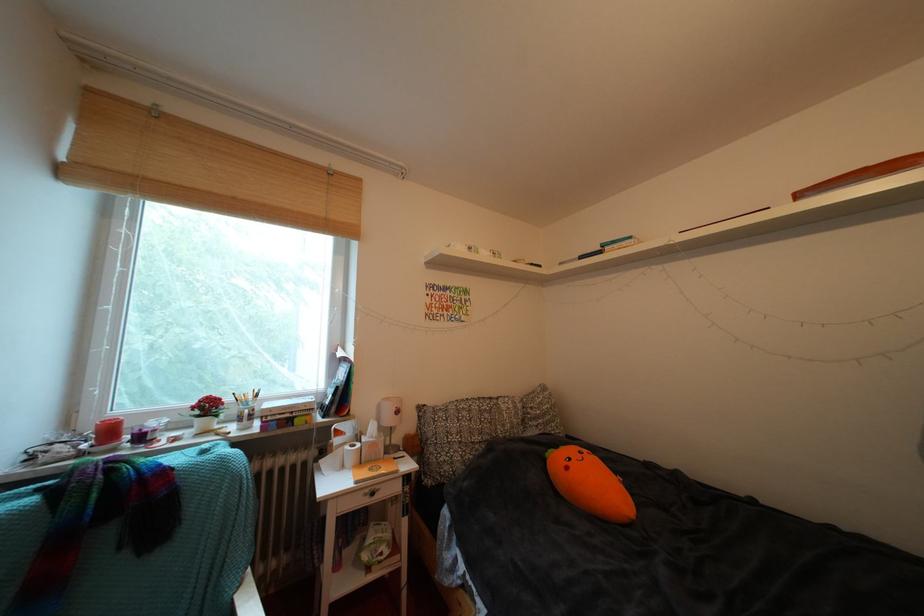
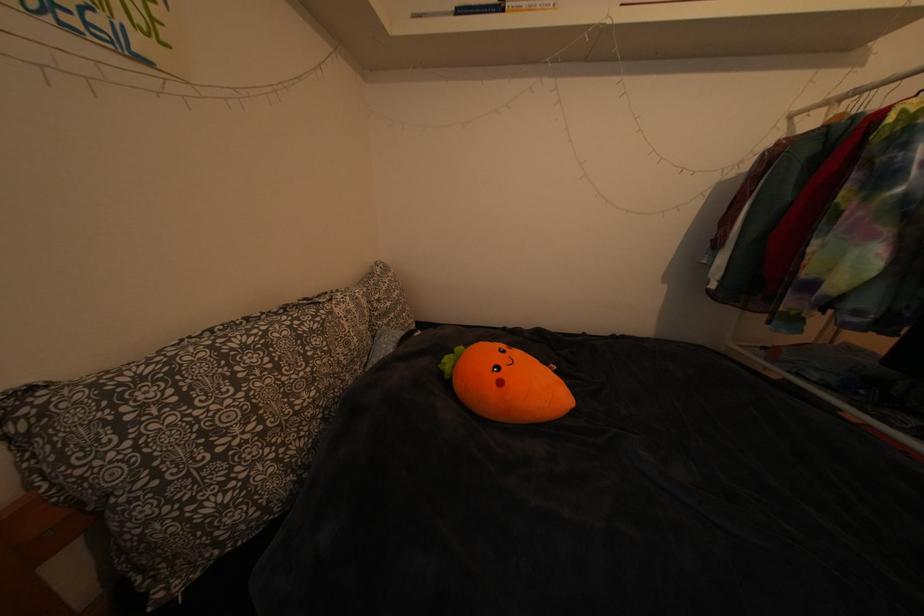
In the second image, find the point that corresponds to point (578, 472) in the first image.

(511, 389)